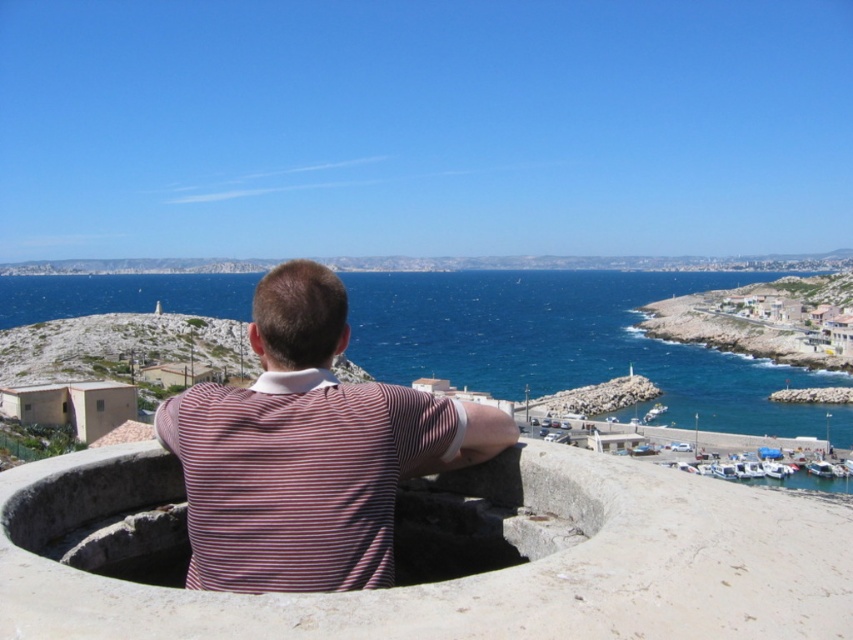
You are standing at the top of a cliff overlooking the coast. You see a striped cotton shirt at center and blue water at center. Which object has a smaller width when viewed from this vantage point?

The striped cotton shirt at center has a smaller width than the blue water at center.